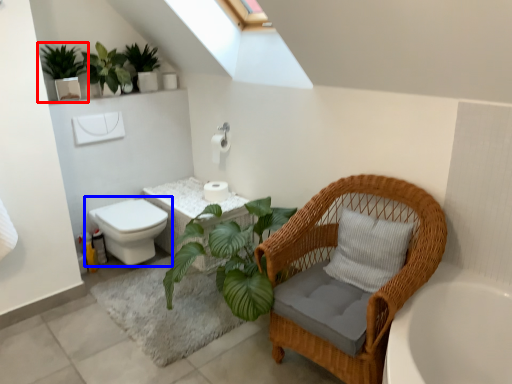
Question: Which of the following is the farthest to the observer, houseplant (highlighted by a red box) or toilet (highlighted by a blue box)?

Choices:
 (A) houseplant
 (B) toilet

Answer: (B)